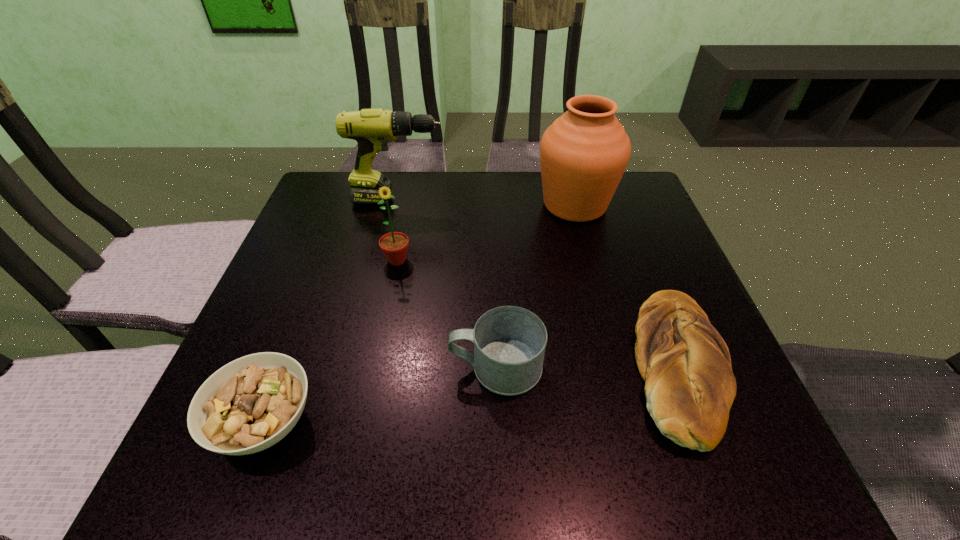
Identify the location of drill that is at the left edge. (372, 128).

I want to click on stew that is at the left edge, so click(x=248, y=405).

Identify the location of urn that is positioned at the right edge. (583, 154).

Where is `bread located at the right edge`? This screenshot has height=540, width=960. bread located at the right edge is located at coordinates (689, 385).

What are the coordinates of `object located at the far left corner` in the screenshot? It's located at (372, 128).

You are a GUI agent. You are given a task and a screenshot of the screen. Output one action in this format:
    pyautogui.click(x=<x>, y=<y>)
    Task: Click on the object at the near left corner
    The image size is (960, 540).
    Given the screenshot: What is the action you would take?
    point(248,405)

This screenshot has width=960, height=540. What are the coordinates of `object located in the far right corner section of the desktop` in the screenshot? It's located at (583, 154).

Identify the location of object positioned at the near right corner. The width and height of the screenshot is (960, 540). (689, 385).

Where is `free region at the far edge of the desktop`? free region at the far edge of the desktop is located at coordinates (470, 171).

In the image, there is a desktop. Where is `vacant space at the near edge`? The height and width of the screenshot is (540, 960). vacant space at the near edge is located at coordinates [519, 458].